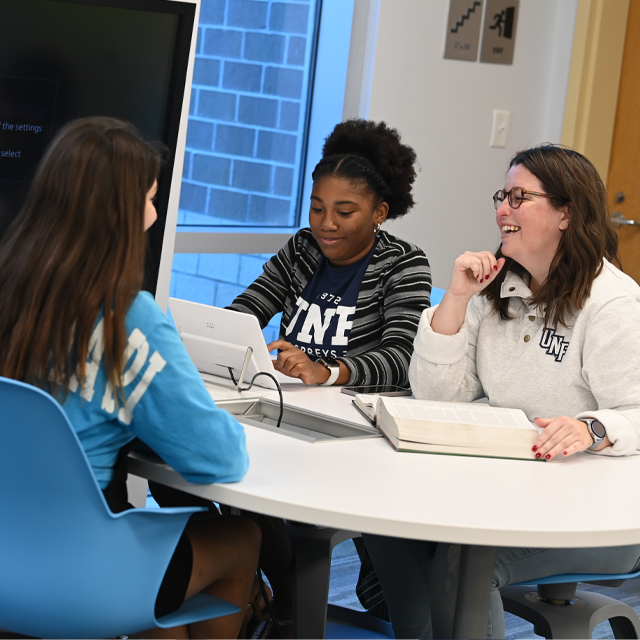
Locate an element on the screen. This screenshot has height=640, width=640. light switch is located at coordinates (498, 136).